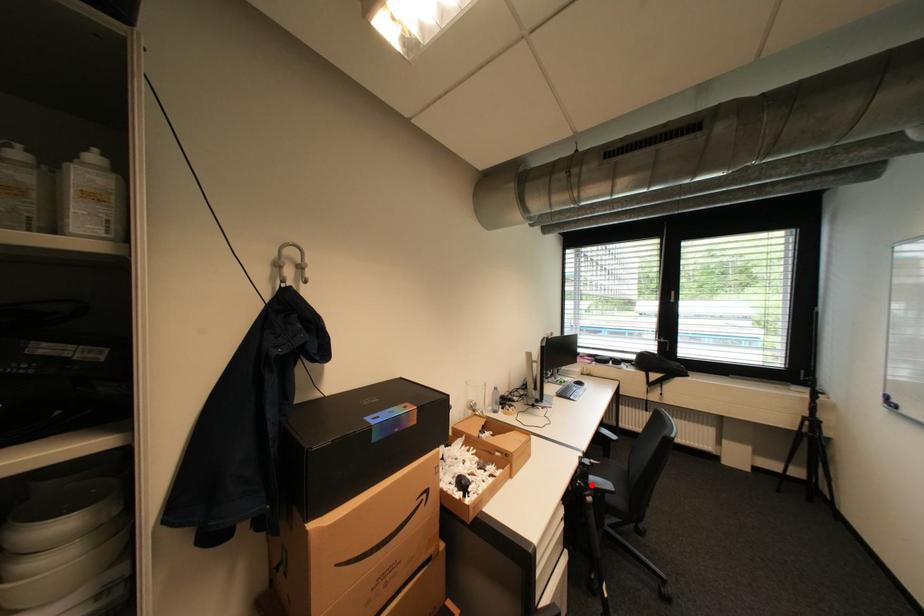
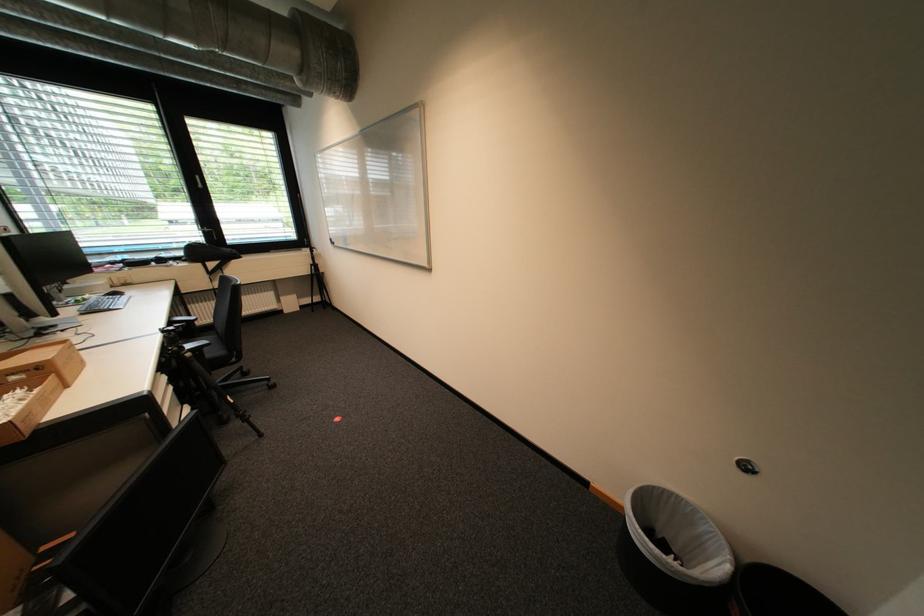
Where in the second image is the point corresponding to the highlighted location from the first image?

(185, 349)